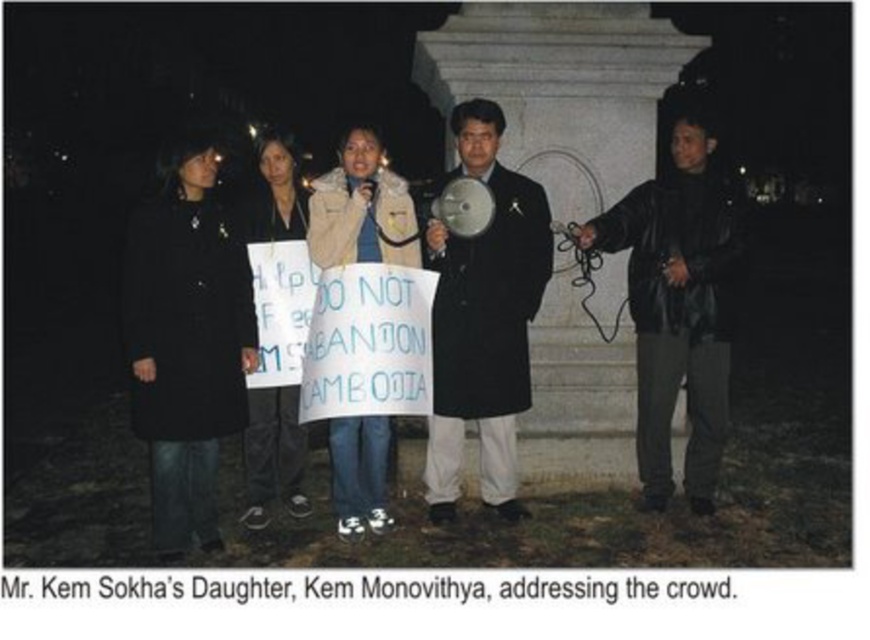
You are a photographer standing at the monument base. You want to take a photo of the beige fleece jacket at center. Where should you aim your camera?

You should aim your camera at point (360, 209) to capture the beige fleece jacket at center.